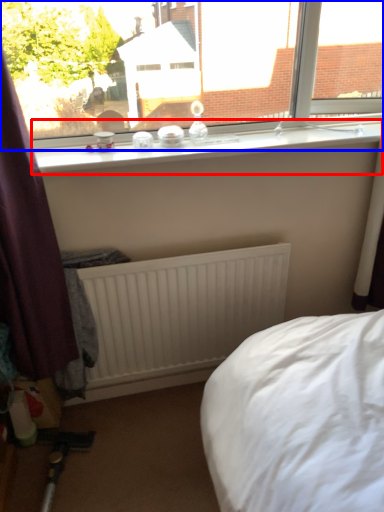
Question: Among these objects, which one is farthest to the camera, window sill (highlighted by a red box) or window (highlighted by a blue box)?

Choices:
 (A) window sill
 (B) window

Answer: (A)